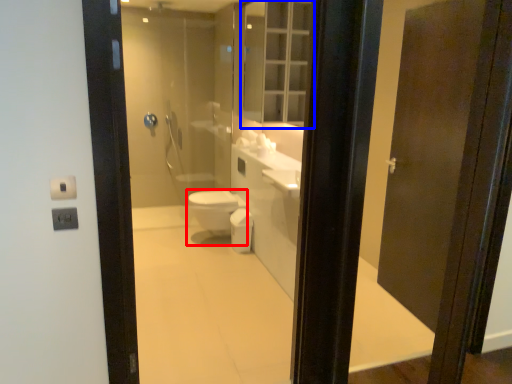
Question: Which point is further to the camera, bidet (highlighted by a red box) or medicine cabinet (highlighted by a blue box)?

Choices:
 (A) bidet
 (B) medicine cabinet

Answer: (A)